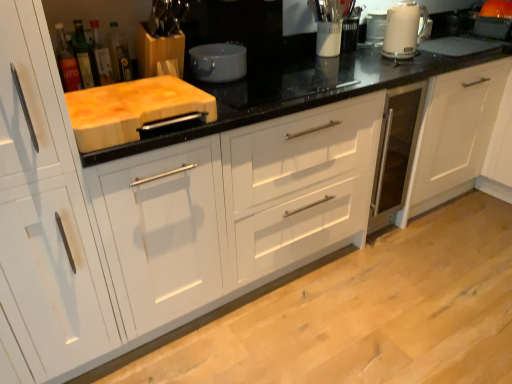
You are a GUI agent. You are given a task and a screenshot of the screen. Output one action in this format:
    pyautogui.click(x=<x>, y=<y>)
    Task: Click on the green glass bottle at upper left, the 3th bottle when ordered from right to left
    The height and width of the screenshot is (384, 512).
    Given the screenshot: What is the action you would take?
    pyautogui.click(x=85, y=57)

The height and width of the screenshot is (384, 512). What do you see at coordinates (134, 110) in the screenshot? I see `natural wood cutting board at left` at bounding box center [134, 110].

Looking at this image, measure the distance between white glossy kettle at upper right and camera.

The depth of white glossy kettle at upper right is 2.28 meters.

You are a GUI agent. You are given a task and a screenshot of the screen. Output one action in this format:
    pyautogui.click(x=<x>, y=<y>)
    Task: Click on the translucent glass bottle at upper left, arranged as the first bottle when viewed from the right
    The image size is (512, 384).
    Given the screenshot: What is the action you would take?
    pyautogui.click(x=119, y=54)

Is point (64, 67) behind point (117, 25)?

No.

From the picture: Is translucent glass bottle at upper left, placed as the fourth bottle when sorted from left to right, at the back of translucent glass bottle at upper left, which is the first bottle in left-to-right order?

translucent glass bottle at upper left, which is the first bottle in left-to-right order, is not turned away from translucent glass bottle at upper left, placed as the fourth bottle when sorted from left to right.

Would you say translucent glass bottle at upper left, which is the first bottle in left-to-right order, is to the left or to the right of translucent glass bottle at upper left, placed as the fourth bottle when sorted from left to right, in the picture?

translucent glass bottle at upper left, which is the first bottle in left-to-right order, is to the left of translucent glass bottle at upper left, placed as the fourth bottle when sorted from left to right.

Is translucent glass bottle at upper left, which is the first bottle in left-to-right order, located outside translucent glass bottle at upper left, arranged as the first bottle when viewed from the right?

translucent glass bottle at upper left, which is the first bottle in left-to-right order, is positioned outside translucent glass bottle at upper left, arranged as the first bottle when viewed from the right.

From a real-world perspective, is translucent glass bottle at upper left, arranged as the first bottle when viewed from the right, over matte gray pot at center?

Yes, from a real-world perspective, translucent glass bottle at upper left, arranged as the first bottle when viewed from the right, is on top of matte gray pot at center.

Considering the sizes of objects translucent glass bottle at upper left, arranged as the first bottle when viewed from the right, and matte gray pot at center in the image provided, who is smaller, translucent glass bottle at upper left, arranged as the first bottle when viewed from the right, or matte gray pot at center?

With smaller size is translucent glass bottle at upper left, arranged as the first bottle when viewed from the right.

Is translucent glass bottle at upper left, placed as the fourth bottle when sorted from left to right, outside of matte gray pot at center?

Indeed, translucent glass bottle at upper left, placed as the fourth bottle when sorted from left to right, is completely outside matte gray pot at center.

Is translucent glass bottle at upper left, placed as the fourth bottle when sorted from left to right, positioned in front of matte gray pot at center?

Yes, translucent glass bottle at upper left, placed as the fourth bottle when sorted from left to right, is closer to the viewer.

Is white glossy kettle at upper right bigger or smaller than translucent glass bottle at upper left, which ranks as the fourth bottle in right-to-left order?

In the image, white glossy kettle at upper right appears to be larger than translucent glass bottle at upper left, which ranks as the fourth bottle in right-to-left order.

In the scene shown: From a real-world perspective, between white glossy kettle at upper right and translucent glass bottle at upper left, which ranks as the fourth bottle in right-to-left order, who is vertically lower?

From a 3D spatial view, white glossy kettle at upper right is below.

Which of these two, white glossy kettle at upper right or translucent glass bottle at upper left, which ranks as the fourth bottle in right-to-left order, stands shorter?

white glossy kettle at upper right.

Is white glossy kettle at upper right spatially inside translucent glass bottle at upper left, which is the first bottle in left-to-right order, or outside of it?

white glossy kettle at upper right cannot be found inside translucent glass bottle at upper left, which is the first bottle in left-to-right order.

Between translucent glass bottle at upper left, placed as the fourth bottle when sorted from left to right, and translucent glass bottle at upper left, which is the first bottle in left-to-right order, which one has less height?

Standing shorter between the two is translucent glass bottle at upper left, placed as the fourth bottle when sorted from left to right.

Is translucent glass bottle at upper left, placed as the fourth bottle when sorted from left to right, facing towards translucent glass bottle at upper left, which ranks as the fourth bottle in right-to-left order?

No, translucent glass bottle at upper left, placed as the fourth bottle when sorted from left to right, is not oriented towards translucent glass bottle at upper left, which ranks as the fourth bottle in right-to-left order.

From the picture: Can you confirm if translucent glass bottle at upper left, placed as the fourth bottle when sorted from left to right, is positioned to the right of translucent glass bottle at upper left, which ranks as the fourth bottle in right-to-left order?

Yes.

Relative to natural wood cutting board at left, is matte gray pot at center in front or behind?

matte gray pot at center is positioned farther from the viewer than natural wood cutting board at left.

Is matte gray pot at center at the right side of natural wood cutting board at left?

Indeed, matte gray pot at center is positioned on the right side of natural wood cutting board at left.

How many degrees apart are the facing directions of matte gray pot at center and natural wood cutting board at left?

0.352 degrees.

At what (x,y) coordinates should I click in order to perform the action: click on cutting board lying below the matte gray pot at center (from the image's perspective). Please return your answer as a coordinate pair (x, y). Image resolution: width=512 pixels, height=384 pixels. Looking at the image, I should click on (134, 110).

In terms of height, does matte gray pot at center look taller or shorter compared to green glass bottle at upper left, the 3th bottle when ordered from right to left?

In the image, matte gray pot at center appears to be shorter than green glass bottle at upper left, the 3th bottle when ordered from right to left.

How different are the orientations of matte gray pot at center and green glass bottle at upper left, placed as the 2th bottle when sorted from left to right, in degrees?

The angular difference between matte gray pot at center and green glass bottle at upper left, placed as the 2th bottle when sorted from left to right, is 1.18 degrees.

From a real-world perspective, who is located higher, matte gray pot at center or green glass bottle at upper left, the 3th bottle when ordered from right to left?

green glass bottle at upper left, the 3th bottle when ordered from right to left.

From a real-world perspective, is matte gray pot at center physically located above or below white glossy electric kettle at upper right?

In terms of real-world spatial position, matte gray pot at center is below white glossy electric kettle at upper right.

Visually, is matte gray pot at center positioned to the left or to the right of white glossy electric kettle at upper right?

Clearly, matte gray pot at center is on the left of white glossy electric kettle at upper right in the image.

Between matte gray pot at center and white glossy electric kettle at upper right, which one has more height?

With more height is white glossy electric kettle at upper right.

Does point (243, 75) come closer to viewer compared to point (393, 43)?

Yes.

The image size is (512, 384). There is a translucent glass bottle at upper left, placed as the fourth bottle when sorted from left to right. In order to click on the 3rd bottle below it (from the image's perspective) in this screenshot , I will do `click(67, 62)`.

This screenshot has height=384, width=512. Find the location of `kitchen appliance on the right of translucent glass bottle at upper left, arranged as the first bottle when viewed from the right`. kitchen appliance on the right of translucent glass bottle at upper left, arranged as the first bottle when viewed from the right is located at coordinates (218, 62).

Estimate the real-world distances between objects in this image. Which object is closer to matte gray pot at center, translucent glass bottle at upper left, arranged as the first bottle when viewed from the right, or white glossy kettle at upper right?

translucent glass bottle at upper left, arranged as the first bottle when viewed from the right.

In the scene shown: Estimate the real-world distances between objects in this image. Which object is closer to white glossy kettle at upper right, translucent glass bottle at upper left, placed as the fourth bottle when sorted from left to right, or matte gray pot at center?

Based on the image, matte gray pot at center appears to be nearer to white glossy kettle at upper right.

Based on the photo, considering their positions, is translucent glass bottle at upper left, which ranks as the fourth bottle in right-to-left order, positioned closer to white glossy kettle at upper right than natural wood cutting board at left?

natural wood cutting board at left.

Based on their spatial positions, is natural wood cutting board at left or translucent glass bottle at upper left, which ranks as the fourth bottle in right-to-left order, closer to white glossy kettle at upper right?

The object closer to white glossy kettle at upper right is natural wood cutting board at left.

Estimate the real-world distances between objects in this image. Which object is further from white glossy kettle at upper right, translucent glass bottle at upper left, which ranks as the fourth bottle in right-to-left order, or matte gray pot at center?

The object further to white glossy kettle at upper right is translucent glass bottle at upper left, which ranks as the fourth bottle in right-to-left order.

From the image, which object appears to be nearer to translucent glass bottle at upper left, placed as the fourth bottle when sorted from left to right, translucent glass bottle at upper left, which is the first bottle in left-to-right order, or translucent glass bottle at upper left, which appears as the second bottle when viewed from the right?

Among the two, translucent glass bottle at upper left, which appears as the second bottle when viewed from the right, is located nearer to translucent glass bottle at upper left, placed as the fourth bottle when sorted from left to right.

Estimate the real-world distances between objects in this image. Which object is closer to natural wood cutting board at left, translucent glass bottle at upper left, placed as the fourth bottle when sorted from left to right, or white glossy kettle at upper right?

translucent glass bottle at upper left, placed as the fourth bottle when sorted from left to right, is closer to natural wood cutting board at left.

Estimate the real-world distances between objects in this image. Which object is closer to green glass bottle at upper left, placed as the 2th bottle when sorted from left to right, matte gray pot at center or translucent glass bottle at upper left, arranged as the first bottle when viewed from the right?

Based on the image, translucent glass bottle at upper left, arranged as the first bottle when viewed from the right, appears to be nearer to green glass bottle at upper left, placed as the 2th bottle when sorted from left to right.

This screenshot has width=512, height=384. In order to click on kitchen appliance between translucent glass bottle at upper left, which appears as the second bottle when viewed from the right, and white glossy kettle at upper right in this screenshot , I will do `click(218, 62)`.

This screenshot has height=384, width=512. What are the coordinates of `appliance between natural wood cutting board at left and white glossy electric kettle at upper right in the horizontal direction` in the screenshot? It's located at [x=375, y=27].

This screenshot has width=512, height=384. Identify the location of appliance between translucent glass bottle at upper left, arranged as the first bottle when viewed from the right, and white glossy electric kettle at upper right. (375, 27).

The image size is (512, 384). I want to click on bottle between green glass bottle at upper left, placed as the 2th bottle when sorted from left to right, and translucent glass bottle at upper left, arranged as the first bottle when viewed from the right, from left to right, so click(101, 56).